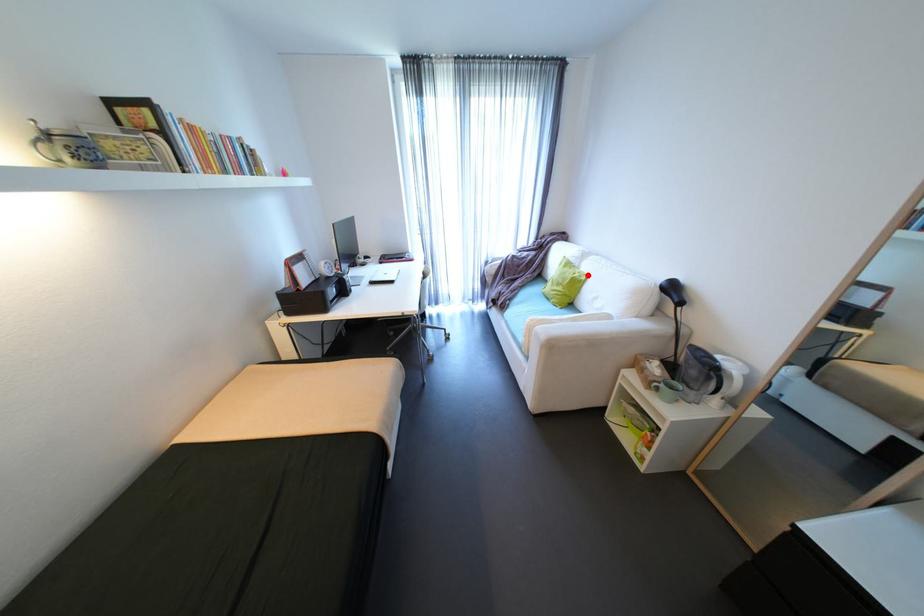
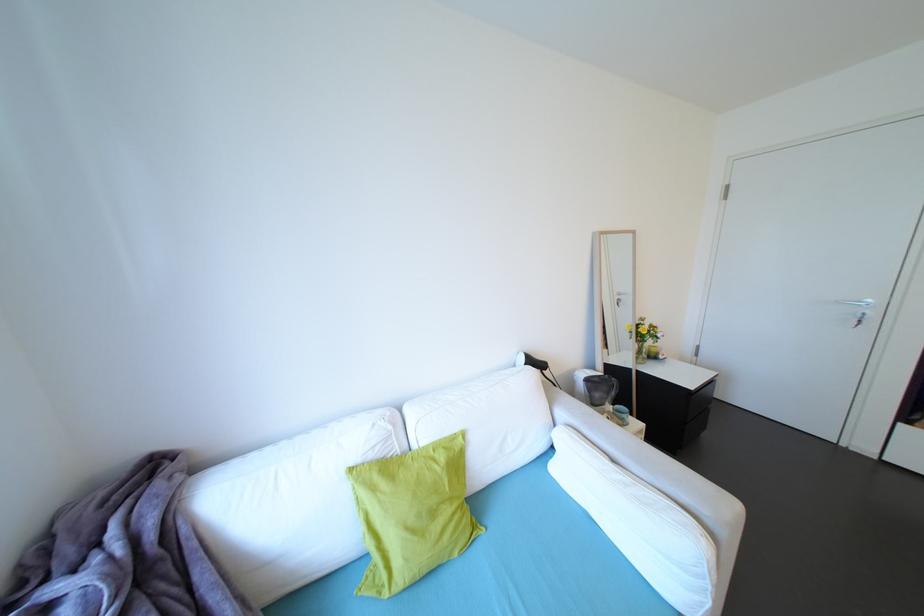
Question: A red point is marked in image1. In image2, is the corresponding 3D point closer to the camera or farther? Reply with the corresponding letter.

Choices:
 (A) The corresponding 3D point is closer.
 (B) The corresponding 3D point is farther.

Answer: (B)